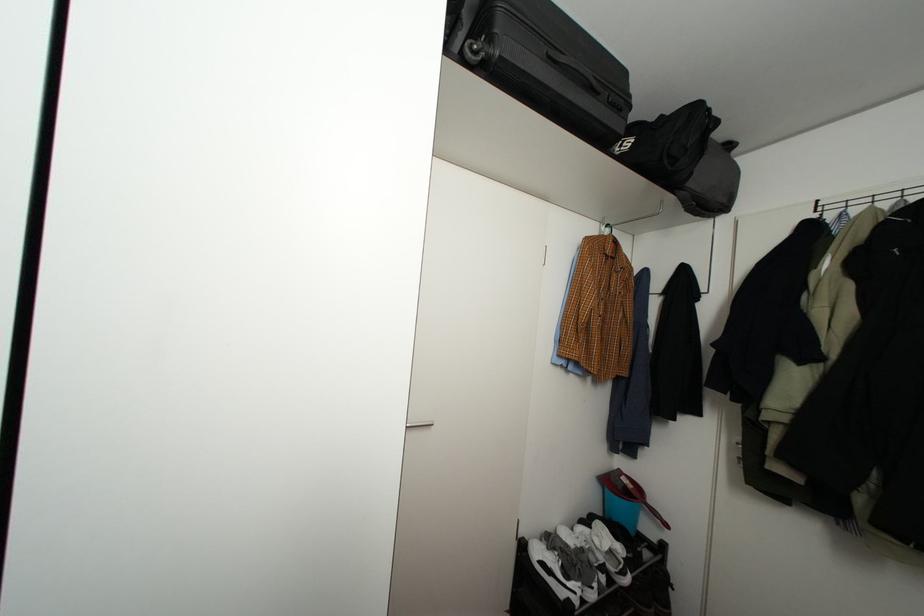
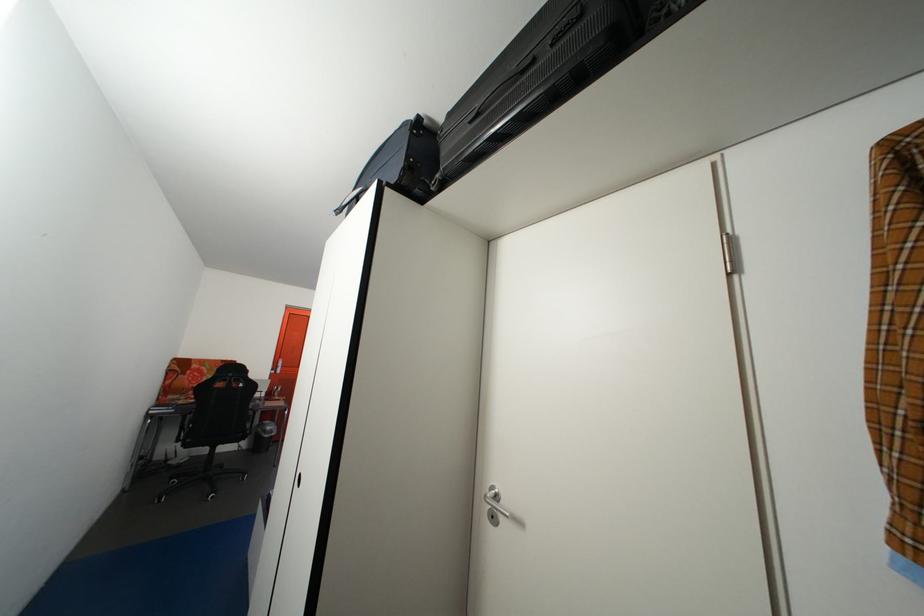
Based on the photo, the first image is from the beginning of the video and the second image is from the end. How did the camera likely rotate when shooting the video?

The camera's rotation is toward left-up.